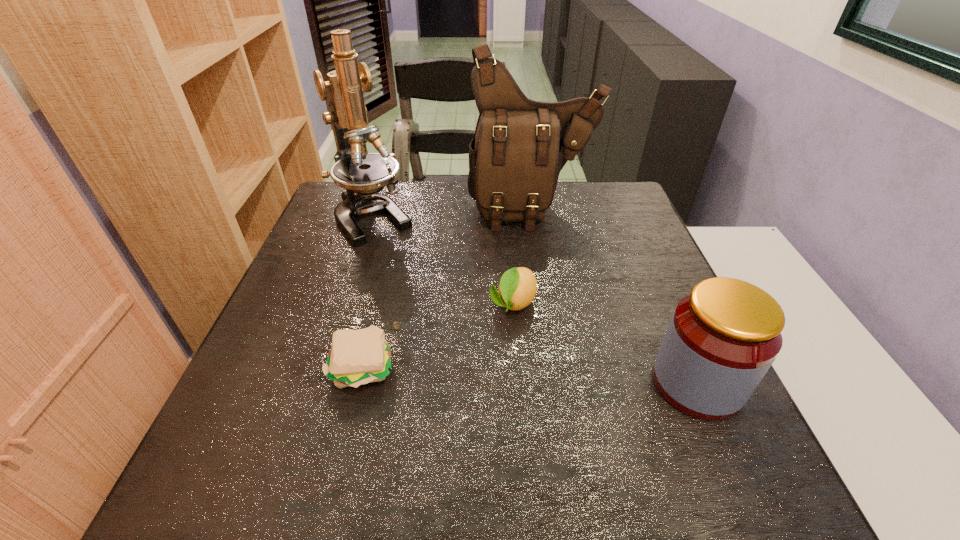
Locate an element on the screen. Image resolution: width=960 pixels, height=540 pixels. jar located in the near edge section of the desktop is located at coordinates (723, 337).

Locate an element on the screen. The image size is (960, 540). patty that is at the left edge is located at coordinates point(357,357).

Locate an element on the screen. microscope present at the left edge is located at coordinates (363, 175).

Locate an element on the screen. This screenshot has width=960, height=540. jar at the right edge is located at coordinates (723, 337).

Find the location of a particular element. shoulder bag located at the right edge is located at coordinates (520, 146).

This screenshot has width=960, height=540. I want to click on object situated at the far left corner, so click(x=363, y=175).

Where is `object that is at the near left corner`? The image size is (960, 540). object that is at the near left corner is located at coordinates 357,357.

Locate an element on the screen. This screenshot has height=540, width=960. object at the far right corner is located at coordinates (520, 146).

Find the location of `object that is at the near right corner`. object that is at the near right corner is located at coordinates (723, 337).

Locate an element on the screen. This screenshot has height=540, width=960. blank area at the far edge is located at coordinates (455, 225).